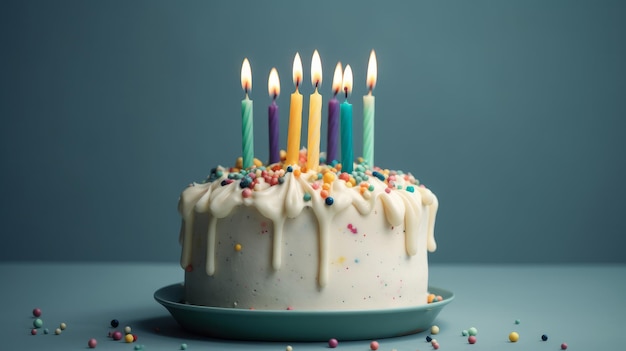
At what (x,y) coordinates should I click in order to perform the action: click on candle wick. Please return your answer as a coordinate pair (x, y). The height and width of the screenshot is (351, 626). Looking at the image, I should click on (244, 94), (275, 96), (295, 87), (316, 88), (335, 94), (345, 94), (369, 85).